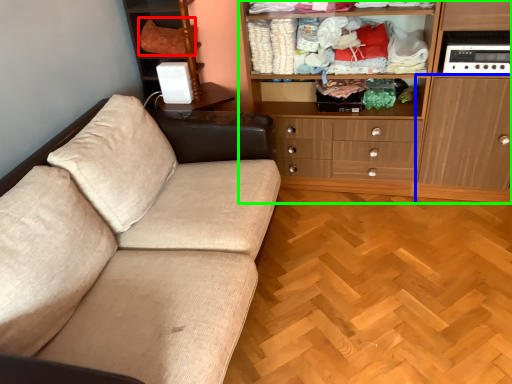
Question: Considering the real-world distances, which object is farthest from clothing (highlighted by a red box)? cabinetry (highlighted by a blue box) or cabinetry (highlighted by a green box)?

Choices:
 (A) cabinetry
 (B) cabinetry

Answer: (A)